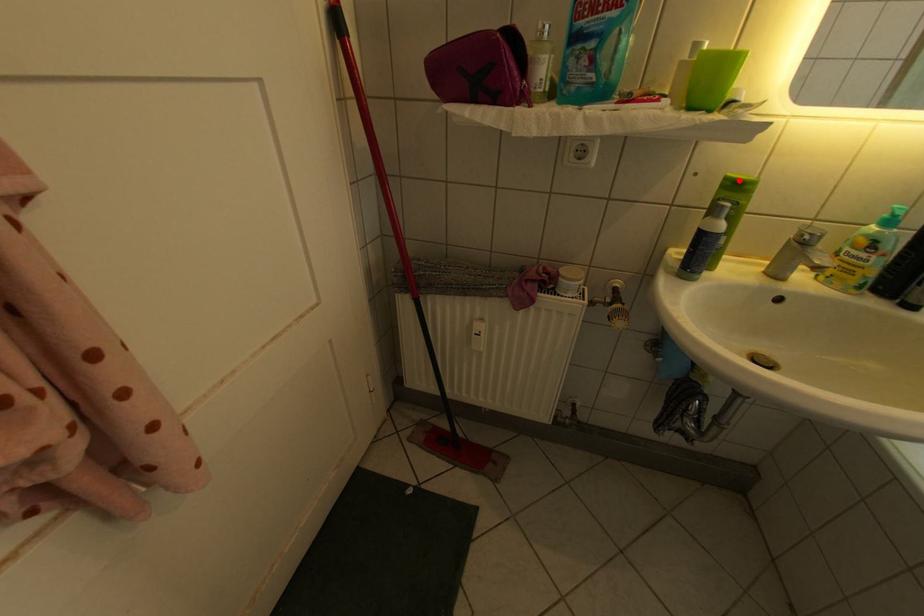
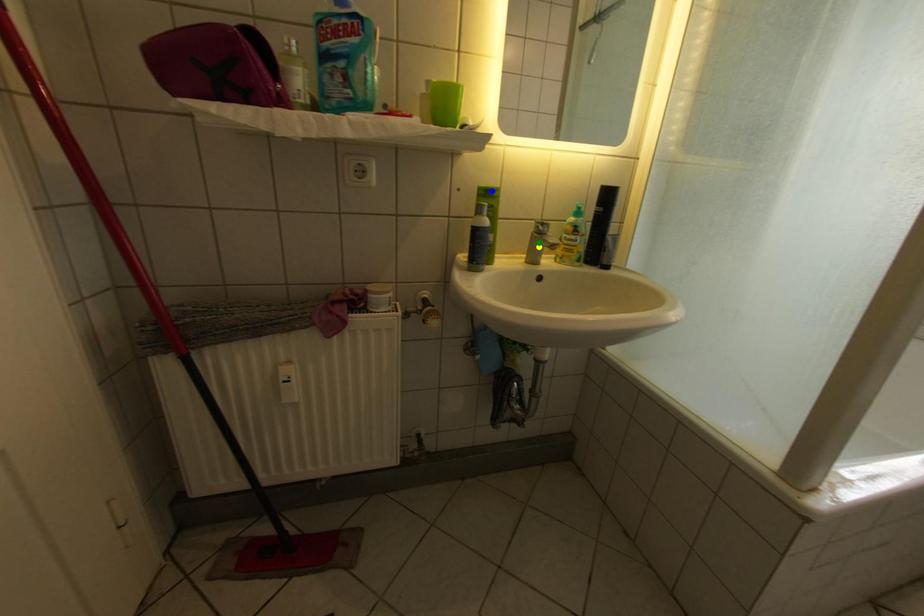
Question: I am providing you with two images of the same scene from different viewpoints. A red point is marked on the first image. You are given multiple points on the second image. In image 2, which mark is for the same physical point as the one in image 1?

Choices:
 (A) yellow point
 (B) green point
 (C) blue point

Answer: (C)